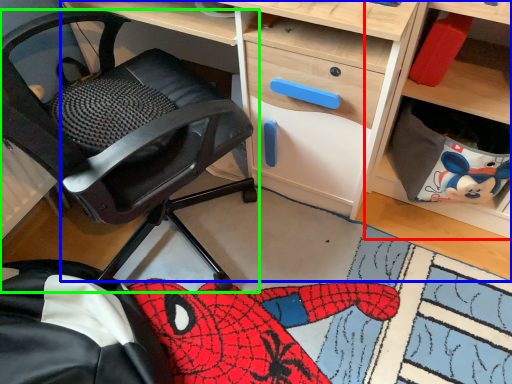
Question: Based on their relative distances, which object is nearer to shelf (highlighted by a red box)? Choose from desk (highlighted by a blue box) and chair (highlighted by a green box).

Choices:
 (A) desk
 (B) chair

Answer: (A)